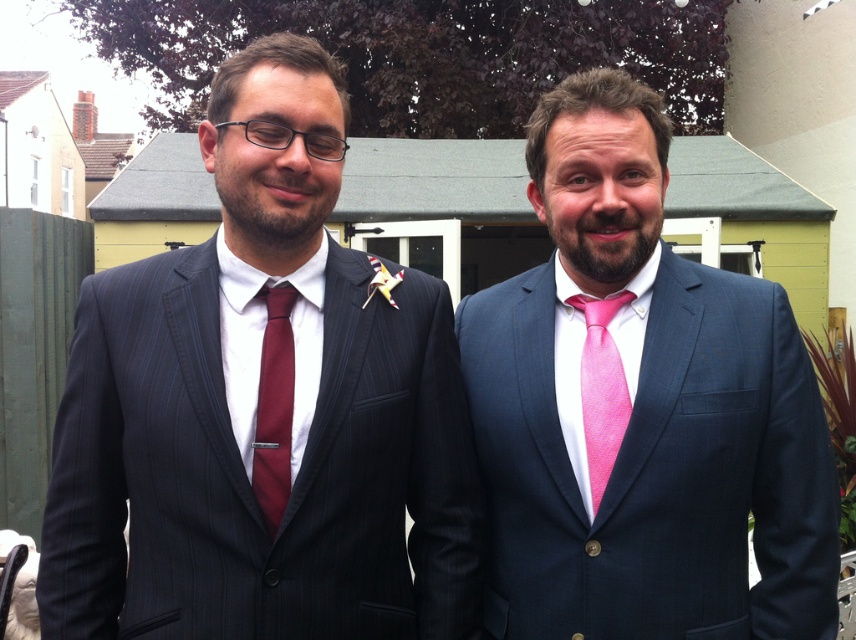
Can you confirm if pink silk suit at center is taller than pink satin tie at right?

Yes, pink silk suit at center is taller than pink satin tie at right.

What do you see at coordinates (640, 410) in the screenshot? I see `pink silk suit at center` at bounding box center [640, 410].

Does point (556, 241) come farther from viewer compared to point (581, 358)?

Yes, point (556, 241) is behind point (581, 358).

This screenshot has height=640, width=856. What are the coordinates of `pink silk suit at center` in the screenshot? It's located at (640, 410).

Can you confirm if burgundy silk tie at center is taller than pink satin tie at right?

Indeed, burgundy silk tie at center has a greater height compared to pink satin tie at right.

Is burgundy silk tie at center thinner than pink satin tie at right?

Correct, burgundy silk tie at center's width is less than pink satin tie at right's.

Locate an element on the screen. burgundy silk tie at center is located at coordinates (274, 406).

Describe the element at coordinates (640, 410) in the screenshot. I see `pink silk suit at center` at that location.

Can you confirm if pink silk suit at center is positioned to the left of burgundy silk tie at center?

In fact, pink silk suit at center is to the right of burgundy silk tie at center.

Which is in front, point (699, 332) or point (289, 472)?

Point (289, 472) is more forward.

Identify the location of pink silk suit at center. The width and height of the screenshot is (856, 640). (640, 410).